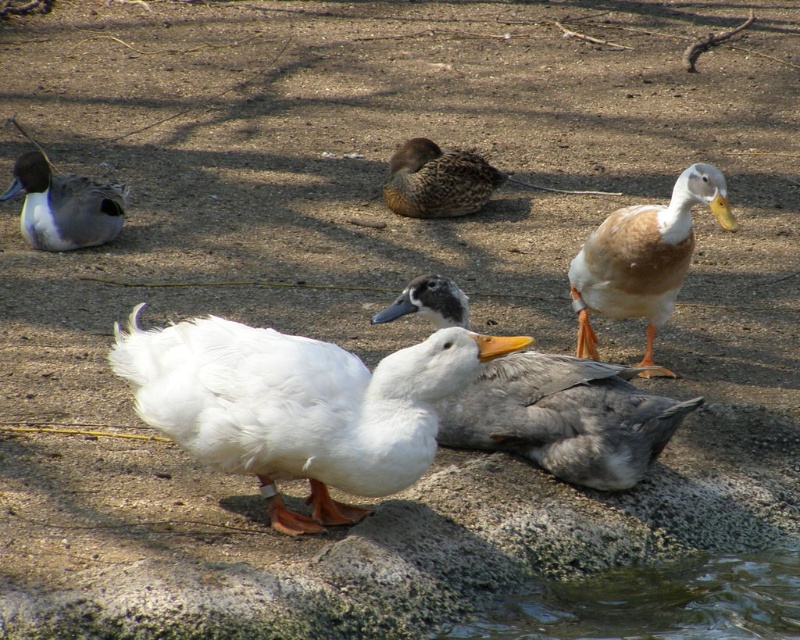
Question: Among these points, which one is nearest to the camera?

Choices:
 (A) (534, 380)
 (B) (297, 397)

Answer: (B)

Question: Among these objects, which one is nearest to the camera?

Choices:
 (A) brown speckled duck at center
 (B) matte gray duck at left

Answer: (B)

Question: Is white matte duck at center to the right of matte gray duck at left from the viewer's perspective?

Choices:
 (A) yes
 (B) no

Answer: (A)

Question: Does white fluffy goose at center appear under white matte duck at center?

Choices:
 (A) yes
 (B) no

Answer: (A)

Question: Observing the image, what is the correct spatial positioning of brown matte duck at upper right in reference to brown speckled duck at center?

Choices:
 (A) right
 (B) left

Answer: (A)

Question: Which object is the farthest from the brown matte duck at upper right?

Choices:
 (A) brown speckled duck at center
 (B) white matte duck at center

Answer: (A)